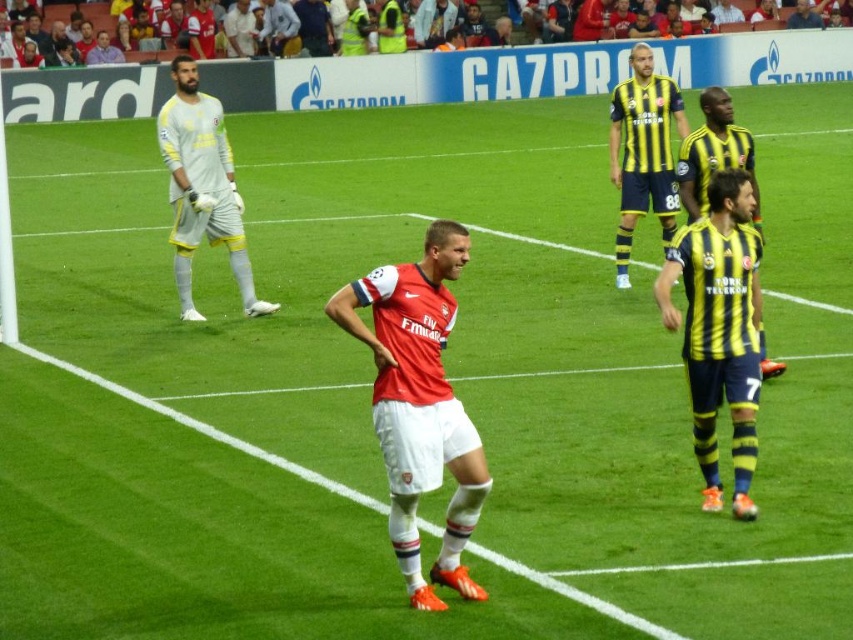
Question: Which of these objects is positioned farthest from the yellow/yellow striped jersey at center?

Choices:
 (A) matte red jersey at center
 (B) yellow and black striped jersey at upper center
 (C) yellow striped jersey at center
 (D) dark blue jersey at upper center

Answer: (D)

Question: Can you confirm if yellow/yellow striped jersey at center is positioned below dark blue jersey at upper center?

Choices:
 (A) yes
 (B) no

Answer: (A)

Question: Can you confirm if yellow striped jersey at center is positioned to the left of dark blue jersey at upper center?

Choices:
 (A) no
 (B) yes

Answer: (B)

Question: Among these objects, which one is farthest from the camera?

Choices:
 (A) yellow/yellow striped jersey at center
 (B) yellow striped jersey at center
 (C) dark blue jersey at upper center
 (D) yellow and black striped jersey at upper center

Answer: (C)

Question: Among these objects, which one is nearest to the camera?

Choices:
 (A) dark blue jersey at upper center
 (B) white matte jersey at left

Answer: (B)

Question: Can you confirm if yellow/yellow striped jersey at center is positioned to the left of yellow striped jersey at center?

Choices:
 (A) no
 (B) yes

Answer: (B)